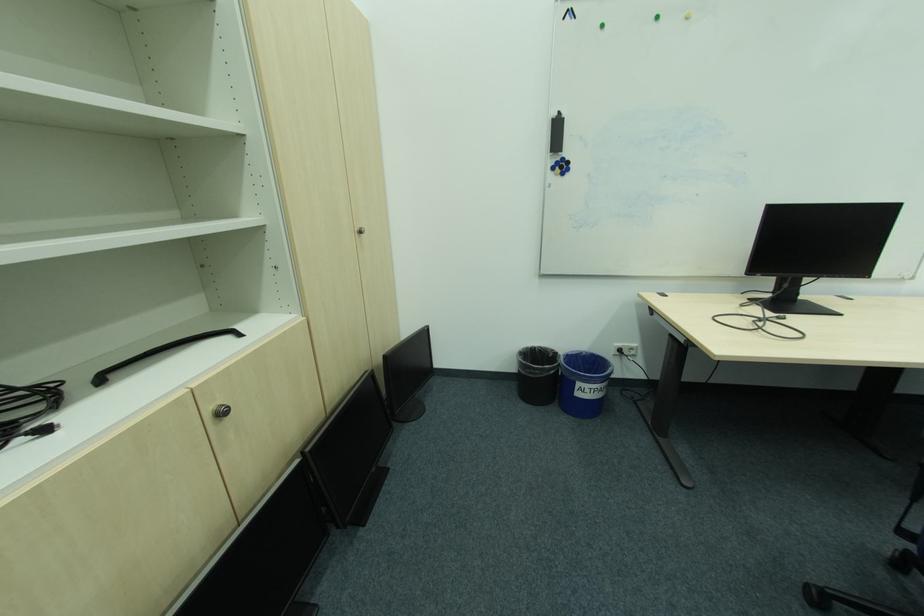
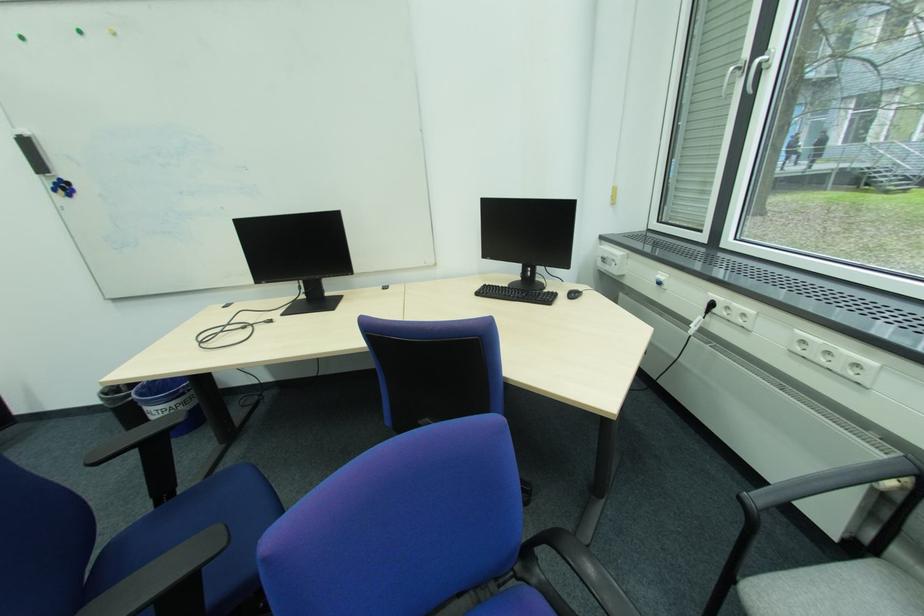
In the second image, find the point that corresponds to point 565,163 in the first image.

(62, 185)